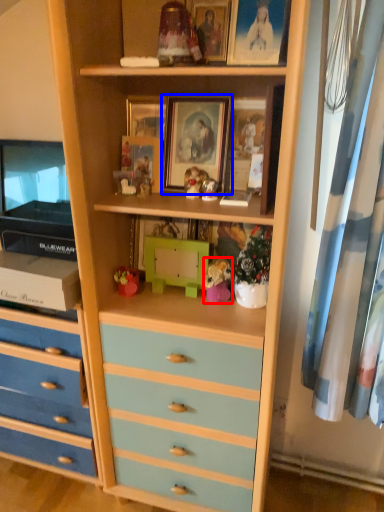
Question: Which of the following is the closest to the observer, toy (highlighted by a red box) or picture frame (highlighted by a blue box)?

Choices:
 (A) toy
 (B) picture frame

Answer: (B)